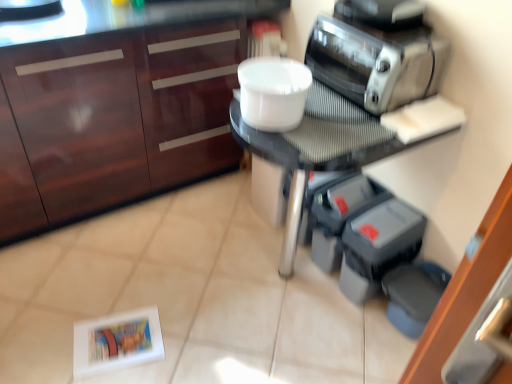
You are a GUI agent. You are given a task and a screenshot of the screen. Output one action in this format:
    pyautogui.click(x=<x>, y=<y>)
    Task: Click on the free space between matte black table at center and gray rubber dumbbells at lower right, arranged as the 2th appliance when viewed from the left
    This screenshot has height=384, width=512.
    Given the screenshot: What is the action you would take?
    pyautogui.click(x=324, y=322)